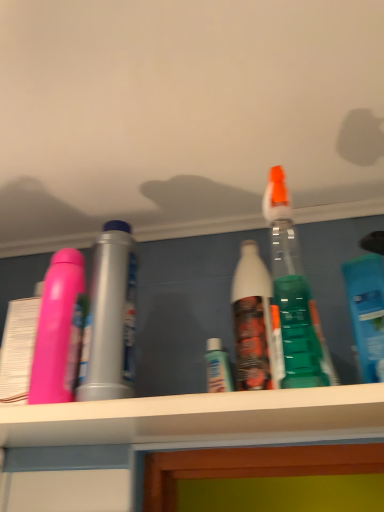
Question: Is pink matte bottle at left, the 2th bottle in the right-to-left sequence, aimed at blue translucent bottle at right, the 1th bottle positioned from the right?

Choices:
 (A) no
 (B) yes

Answer: (A)

Question: From a real-world perspective, is pink matte bottle at left, the 1th bottle when ordered from left to right, over blue translucent bottle at right, the 1th bottle positioned from the right?

Choices:
 (A) yes
 (B) no

Answer: (A)

Question: Is pink matte bottle at left, the 2th bottle in the right-to-left sequence, in front of blue translucent bottle at right, the 1th bottle positioned from the right?

Choices:
 (A) yes
 (B) no

Answer: (B)

Question: Is pink matte bottle at left, the 1th bottle when ordered from left to right, completely or partially outside of blue translucent bottle at right, the 1th bottle positioned from the right?

Choices:
 (A) no
 (B) yes

Answer: (B)

Question: From a real-world perspective, is pink matte bottle at left, the 2th bottle in the right-to-left sequence, physically below blue translucent bottle at right, the 1th bottle positioned from the right?

Choices:
 (A) yes
 (B) no

Answer: (B)

Question: From the image's perspective, would you say pink matte bottle at left, the 1th bottle when ordered from left to right, is positioned over blue translucent bottle at right, the 1th bottle positioned from the right?

Choices:
 (A) yes
 (B) no

Answer: (B)

Question: From the image's perspective, is blue translucent bottle at right, the second bottle from the left, beneath pink matte bottle at left, the 2th bottle in the right-to-left sequence?

Choices:
 (A) no
 (B) yes

Answer: (A)

Question: From the image's perspective, is blue translucent bottle at right, the 1th bottle positioned from the right, on pink matte bottle at left, the 2th bottle in the right-to-left sequence?

Choices:
 (A) yes
 (B) no

Answer: (A)

Question: Does blue translucent bottle at right, the second bottle from the left, have a greater height compared to pink matte bottle at left, the 1th bottle when ordered from left to right?

Choices:
 (A) yes
 (B) no

Answer: (B)

Question: Is blue translucent bottle at right, the 1th bottle positioned from the right, located outside pink matte bottle at left, the 1th bottle when ordered from left to right?

Choices:
 (A) yes
 (B) no

Answer: (A)

Question: Can you confirm if blue translucent bottle at right, the 1th bottle positioned from the right, is shorter than pink matte bottle at left, the 1th bottle when ordered from left to right?

Choices:
 (A) yes
 (B) no

Answer: (A)

Question: Does blue translucent bottle at right, the second bottle from the left, appear on the left side of pink matte bottle at left, the 1th bottle when ordered from left to right?

Choices:
 (A) yes
 (B) no

Answer: (B)

Question: Considering the positions of blue translucent bottle at right, the second bottle from the left, and pink matte bottle at left, the 1th bottle when ordered from left to right, in the image, is blue translucent bottle at right, the second bottle from the left, bigger or smaller than pink matte bottle at left, the 1th bottle when ordered from left to right,?

Choices:
 (A) big
 (B) small

Answer: (A)